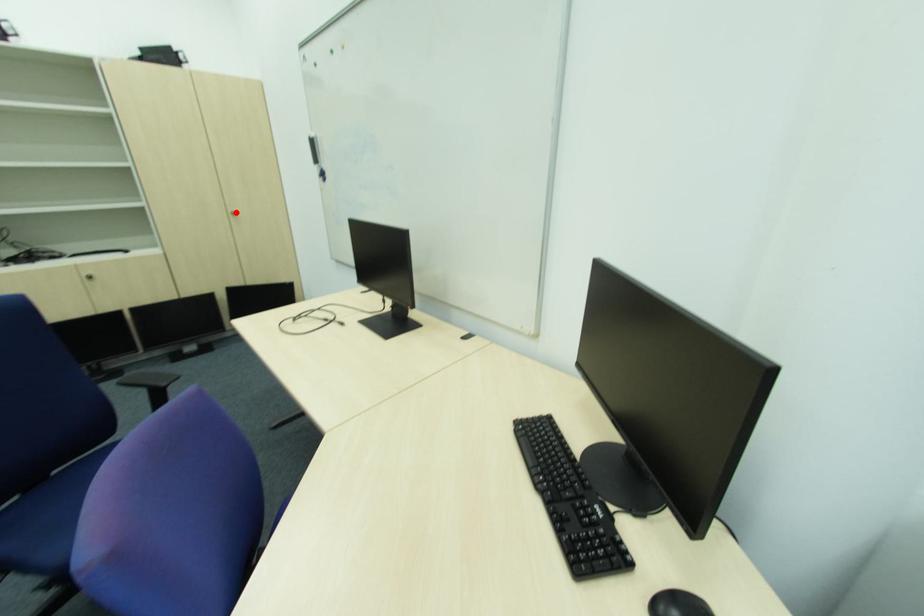
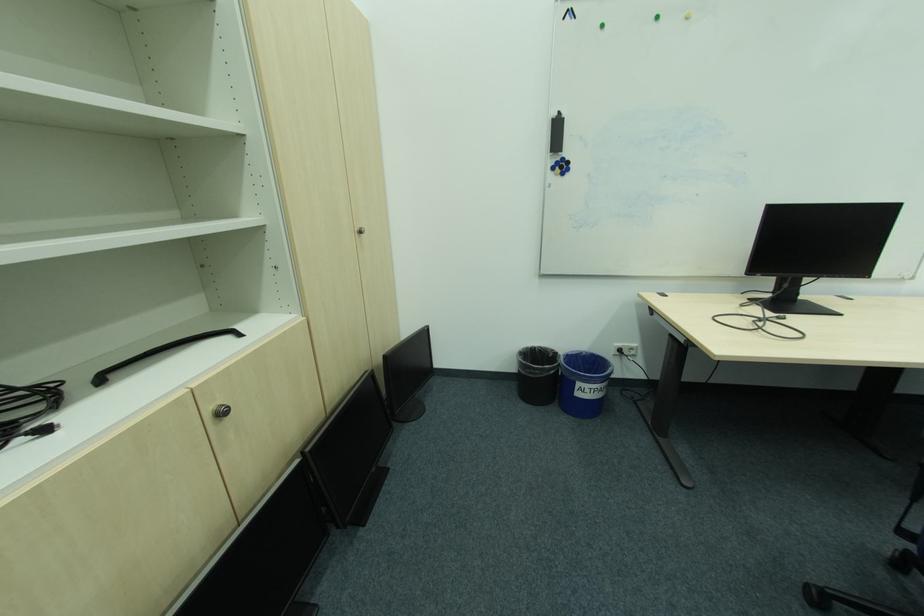
Where in the second image is the point corresponding to the highlighted location from the first image?

(363, 229)